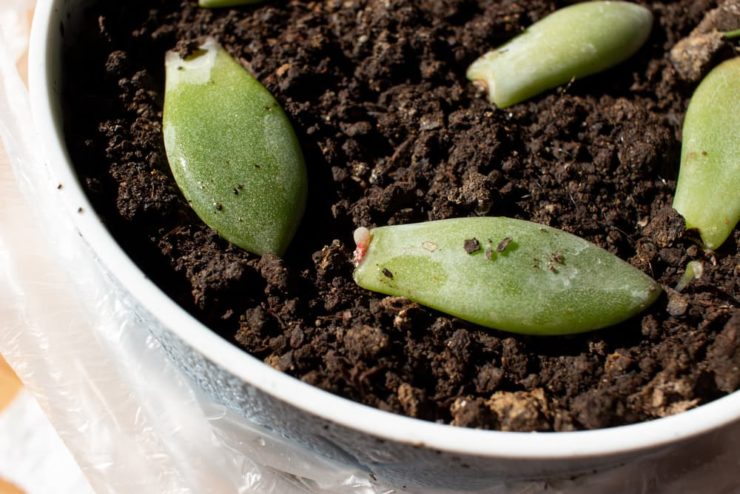
At what (x,y) coordinates should I click in order to perform the action: click on succulent. Please return your answer as a coordinate pair (x, y). Image resolution: width=740 pixels, height=494 pixels. Looking at the image, I should click on (460, 291), (266, 175), (531, 68), (713, 149).